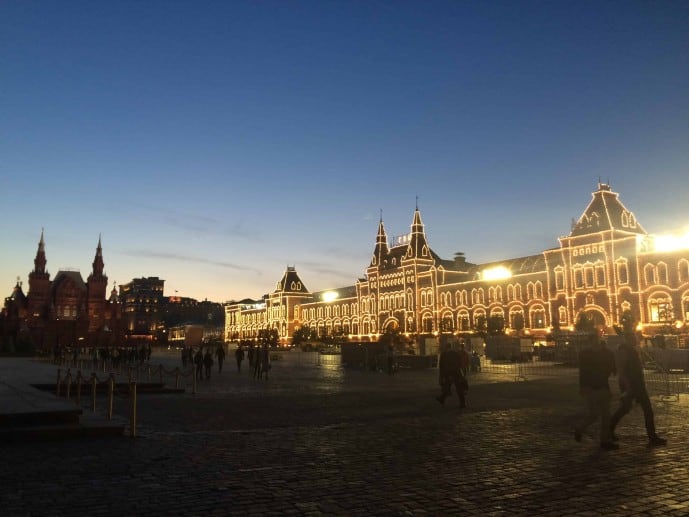
Image resolution: width=689 pixels, height=517 pixels. Identify the location of main entrance archway. (391, 316).